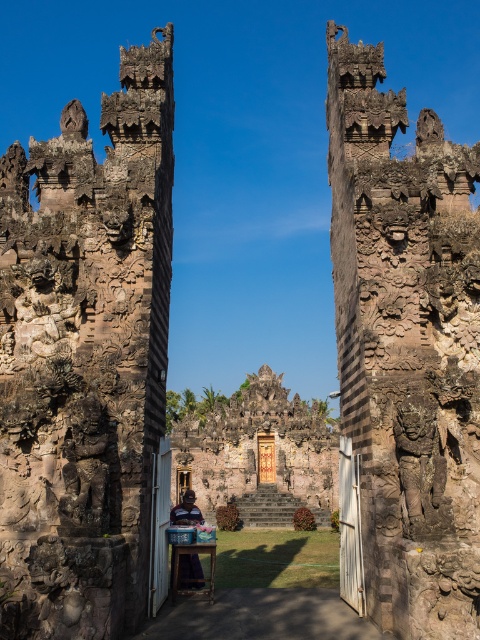
Question: Which object appears closest to the camera in this image?

Choices:
 (A) blue fabric at center
 (B) brown stone ruins at center
 (C) rusty stone carvings at left

Answer: (C)

Question: Is blue fabric at center positioned in front of wooden stool at center?

Choices:
 (A) no
 (B) yes

Answer: (A)

Question: Is carved stone temple at center smaller than blue fabric at center?

Choices:
 (A) no
 (B) yes

Answer: (A)

Question: Which object is farther from the camera taking this photo?

Choices:
 (A) brown stone ruins at center
 (B) wooden stool at center
 (C) carved stone temple at center

Answer: (C)

Question: Which point appears closest to the camera in this image?

Choices:
 (A) (179, 573)
 (B) (199, 480)
 (C) (6, 417)
 (D) (392, 496)

Answer: (D)

Question: Can you confirm if brown stone ruins at center is smaller than wooden stool at center?

Choices:
 (A) no
 (B) yes

Answer: (A)